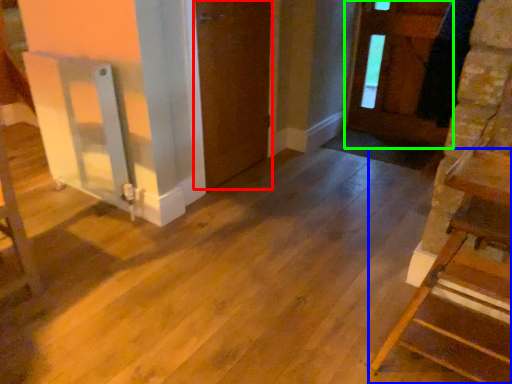
Question: Which object is the farthest from door (highlighted by a red box)? Choose among these: furniture (highlighted by a blue box) or door (highlighted by a green box).

Choices:
 (A) furniture
 (B) door

Answer: (A)